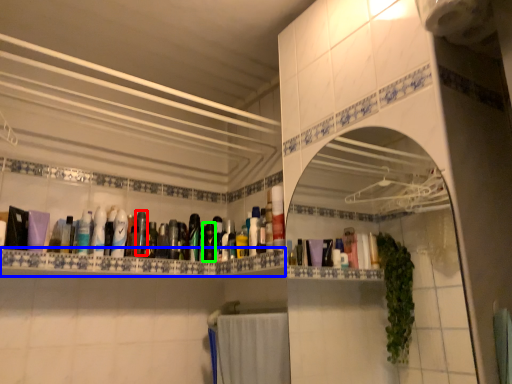
Question: Estimate the real-world distances between objects in this image. Which object is closer to toiletry (highlighted by a red box), ledge (highlighted by a blue box) or toiletry (highlighted by a green box)?

Choices:
 (A) ledge
 (B) toiletry

Answer: (B)